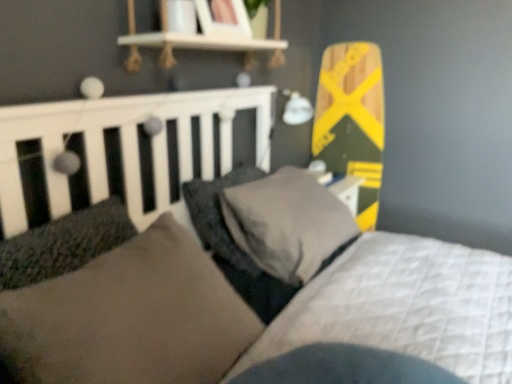
The image size is (512, 384). What do you see at coordinates (352, 120) in the screenshot?
I see `yellow-green wood skateboard at upper right` at bounding box center [352, 120].

Measure the distance between point (281, 248) and camera.

The depth of point (281, 248) is 4.71 feet.

What is the approximate height of suede-like brown pillow at center, which is the first pillow in front-to-back order?

12.49 inches.

Find the location of a particular element. This screenshot has height=384, width=512. yellow-green wood skateboard at upper right is located at coordinates point(352,120).

Based on the photo, from the image's perspective, which is below, dark gray textured pillow at center, the first pillow viewed from the back, or dark gray plush pillow at center, the second pillow positioned from the front?

From the image's view, dark gray plush pillow at center, the second pillow positioned from the front, is below.

Is point (199, 209) positioned behind point (253, 224)?

Yes, it is behind point (253, 224).

From a real-world perspective, is dark gray textured pillow at center, placed as the 3th pillow when sorted from front to back, located beneath dark gray plush pillow at center, the second pillow positioned from the front?

Yes, from a real-world perspective, dark gray textured pillow at center, placed as the 3th pillow when sorted from front to back, is under dark gray plush pillow at center, the second pillow positioned from the front.

Considering the relative sizes of dark gray textured pillow at center, the first pillow viewed from the back, and dark gray plush pillow at center, the second pillow positioned from the front, in the image provided, is dark gray textured pillow at center, the first pillow viewed from the back, bigger than dark gray plush pillow at center, the second pillow positioned from the front,?

Actually, dark gray textured pillow at center, the first pillow viewed from the back, might be smaller than dark gray plush pillow at center, the second pillow positioned from the front.

Choose the correct answer: Is dark gray textured pillow at center, the first pillow viewed from the back, inside suede-like brown pillow at center, which is the first pillow in front-to-back order, or outside it?

dark gray textured pillow at center, the first pillow viewed from the back, is spatially situated outside suede-like brown pillow at center, which is the first pillow in front-to-back order.

Is there a large distance between dark gray textured pillow at center, placed as the 3th pillow when sorted from front to back, and suede-like brown pillow at center, the third pillow from the back?

That's not correct — dark gray textured pillow at center, placed as the 3th pillow when sorted from front to back, is a little close to suede-like brown pillow at center, the third pillow from the back.

Is dark gray textured pillow at center, the first pillow viewed from the back, smaller than suede-like brown pillow at center, which is the first pillow in front-to-back order?

Yes, dark gray textured pillow at center, the first pillow viewed from the back, is smaller than suede-like brown pillow at center, which is the first pillow in front-to-back order.

Is dark gray textured pillow at center, the first pillow viewed from the back, aimed at suede-like brown pillow at center, which is the first pillow in front-to-back order?

No.

From the image's perspective, who appears lower, suede-like brown pillow at center, the third pillow from the back, or dark gray plush pillow at center, the second pillow viewed from the back?

suede-like brown pillow at center, the third pillow from the back, appears lower in the image.

Between suede-like brown pillow at center, the third pillow from the back, and dark gray plush pillow at center, the second pillow positioned from the front, which one has smaller width?

suede-like brown pillow at center, the third pillow from the back, is thinner.

From a real-world perspective, is suede-like brown pillow at center, the third pillow from the back, below dark gray plush pillow at center, the second pillow positioned from the front?

No, from a real-world perspective, suede-like brown pillow at center, the third pillow from the back, is not under dark gray plush pillow at center, the second pillow positioned from the front.

Relative to dark gray plush pillow at center, the second pillow positioned from the front, is suede-like brown pillow at center, which is the first pillow in front-to-back order, in front or behind?

Visually, suede-like brown pillow at center, which is the first pillow in front-to-back order, is located in front of dark gray plush pillow at center, the second pillow positioned from the front.

Which is more to the right, yellow-green wood skateboard at upper right or suede-like brown pillow at center, the third pillow from the back?

yellow-green wood skateboard at upper right is more to the right.

From the picture: Which object is further away from the camera, yellow-green wood skateboard at upper right or suede-like brown pillow at center, which is the first pillow in front-to-back order?

Positioned behind is yellow-green wood skateboard at upper right.

From a real-world perspective, is yellow-green wood skateboard at upper right over suede-like brown pillow at center, the third pillow from the back?

Correct, in the physical world, yellow-green wood skateboard at upper right is higher than suede-like brown pillow at center, the third pillow from the back.

Looking at this image, what's the angular difference between suede-like brown pillow at center, which is the first pillow in front-to-back order, and yellow-green wood skateboard at upper right's facing directions?

There is a 93.3-degree angle between the facing directions of suede-like brown pillow at center, which is the first pillow in front-to-back order, and yellow-green wood skateboard at upper right.

From the yellow-green wood skateboard at upper right, count the 3rd pillow to the left and point to it. Please provide its 2D coordinates.

[(130, 317)]

Is suede-like brown pillow at center, the third pillow from the back, at the right side of yellow-green wood skateboard at upper right?

Incorrect, suede-like brown pillow at center, the third pillow from the back, is not on the right side of yellow-green wood skateboard at upper right.

Is suede-like brown pillow at center, which is the first pillow in front-to-back order, taller than yellow-green wood skateboard at upper right?

Incorrect, the height of suede-like brown pillow at center, which is the first pillow in front-to-back order, is not larger of that of yellow-green wood skateboard at upper right.

Is yellow-green wood skateboard at upper right oriented towards dark gray plush pillow at center, the second pillow positioned from the front?

Yes, yellow-green wood skateboard at upper right is turned towards dark gray plush pillow at center, the second pillow positioned from the front.

From the image's perspective, which is below, yellow-green wood skateboard at upper right or dark gray plush pillow at center, the second pillow positioned from the front?

dark gray plush pillow at center, the second pillow positioned from the front.

Are yellow-green wood skateboard at upper right and dark gray plush pillow at center, the second pillow positioned from the front, located far from each other?

They are positioned close to each other.

Considering the relative sizes of dark gray plush pillow at center, the second pillow positioned from the front, and suede-like brown pillow at center, which is the first pillow in front-to-back order, in the image provided, is dark gray plush pillow at center, the second pillow positioned from the front, taller than suede-like brown pillow at center, which is the first pillow in front-to-back order,?

No.

Is dark gray plush pillow at center, the second pillow positioned from the front, wider or thinner than suede-like brown pillow at center, which is the first pillow in front-to-back order?

Considering their sizes, dark gray plush pillow at center, the second pillow positioned from the front, looks broader than suede-like brown pillow at center, which is the first pillow in front-to-back order.

Which point is more forward, (253,240) or (135,289)?

Positioned in front is point (135,289).

From the image's perspective, which one is positioned higher, dark gray plush pillow at center, the second pillow viewed from the back, or suede-like brown pillow at center, which is the first pillow in front-to-back order?

dark gray plush pillow at center, the second pillow viewed from the back, appears higher in the image.

At what (x,y) coordinates should I click in order to perform the action: click on pillow lying above the dark gray plush pillow at center, the second pillow positioned from the front (from the image's perspective). Please return your answer as a coordinate pair (x, y). Image resolution: width=512 pixels, height=384 pixels. Looking at the image, I should click on (219, 216).

Where is `the 2nd pillow positioned above the dark gray textured pillow at center, the first pillow viewed from the back (from a real-world perspective)`? the 2nd pillow positioned above the dark gray textured pillow at center, the first pillow viewed from the back (from a real-world perspective) is located at coordinates (130, 317).

Which object lies further to the anchor point yellow-green wood skateboard at upper right, dark gray textured pillow at center, the first pillow viewed from the back, or suede-like brown pillow at center, the third pillow from the back?

Among the two, suede-like brown pillow at center, the third pillow from the back, is located further to yellow-green wood skateboard at upper right.

From the image, which object appears to be nearer to yellow-green wood skateboard at upper right, suede-like brown pillow at center, the third pillow from the back, or dark gray plush pillow at center, the second pillow positioned from the front?

dark gray plush pillow at center, the second pillow positioned from the front, is positioned closer to the anchor yellow-green wood skateboard at upper right.

From the image, which object appears to be nearer to dark gray textured pillow at center, placed as the 3th pillow when sorted from front to back, yellow-green wood skateboard at upper right or dark gray plush pillow at center, the second pillow positioned from the front?

dark gray plush pillow at center, the second pillow positioned from the front.

Considering their positions, is yellow-green wood skateboard at upper right positioned further to dark gray plush pillow at center, the second pillow viewed from the back, than suede-like brown pillow at center, which is the first pillow in front-to-back order?

Based on the image, yellow-green wood skateboard at upper right appears to be further to dark gray plush pillow at center, the second pillow viewed from the back.

Considering their positions, is dark gray textured pillow at center, the first pillow viewed from the back, positioned further to suede-like brown pillow at center, which is the first pillow in front-to-back order, than yellow-green wood skateboard at upper right?

Among the two, yellow-green wood skateboard at upper right is located further to suede-like brown pillow at center, which is the first pillow in front-to-back order.

Looking at the image, which one is located closer to suede-like brown pillow at center, which is the first pillow in front-to-back order, yellow-green wood skateboard at upper right or dark gray textured pillow at center, placed as the 3th pillow when sorted from front to back?

dark gray textured pillow at center, placed as the 3th pillow when sorted from front to back, is closer to suede-like brown pillow at center, which is the first pillow in front-to-back order.

When comparing their distances from yellow-green wood skateboard at upper right, does dark gray plush pillow at center, the second pillow viewed from the back, or dark gray textured pillow at center, the first pillow viewed from the back, seem further?

Based on the image, dark gray textured pillow at center, the first pillow viewed from the back, appears to be further to yellow-green wood skateboard at upper right.

Considering their positions, is dark gray plush pillow at center, the second pillow viewed from the back, positioned further to yellow-green wood skateboard at upper right than suede-like brown pillow at center, which is the first pillow in front-to-back order?

The object further to yellow-green wood skateboard at upper right is suede-like brown pillow at center, which is the first pillow in front-to-back order.

Where is `pillow between dark gray plush pillow at center, the second pillow positioned from the front, and yellow-green wood skateboard at upper right, along the z-axis`? pillow between dark gray plush pillow at center, the second pillow positioned from the front, and yellow-green wood skateboard at upper right, along the z-axis is located at coordinates (219, 216).

The height and width of the screenshot is (384, 512). I want to click on pillow between suede-like brown pillow at center, which is the first pillow in front-to-back order, and dark gray textured pillow at center, the first pillow viewed from the back, from front to back, so click(x=287, y=223).